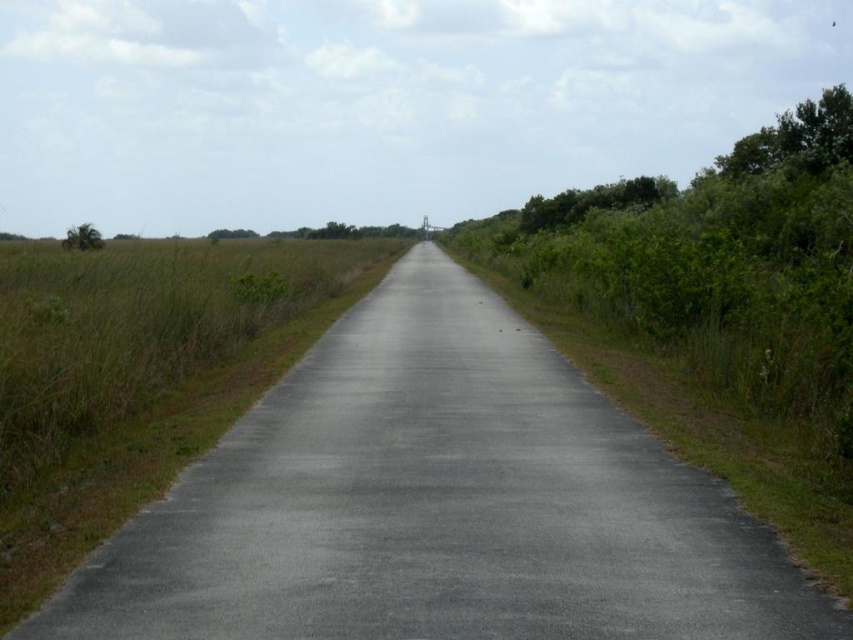
Who is taller, gray asphalt road at center or green leafy tree at right?

With more height is green leafy tree at right.

Between gray asphalt road at center and green leafy tree at right, which one appears on the left side from the viewer's perspective?

gray asphalt road at center is more to the left.

Between point (450, 609) and point (635, 200), which one is positioned behind?

The point (635, 200) is behind.

Locate an element on the screen. gray asphalt road at center is located at coordinates (438, 504).

Which of these two, green leafy tree at upper right or green leafy tree at left, stands taller?

green leafy tree at upper right is taller.

Where is `green leafy tree at upper right`? The width and height of the screenshot is (853, 640). green leafy tree at upper right is located at coordinates (x=796, y=140).

The width and height of the screenshot is (853, 640). Find the location of `green leafy tree at upper right`. green leafy tree at upper right is located at coordinates (796, 140).

Is gray asphalt road at center shorter than green grass at center?

Correct, gray asphalt road at center is not as tall as green grass at center.

Is the position of gray asphalt road at center more distant than that of green grass at center?

No, gray asphalt road at center is in front of green grass at center.

Find the location of `gray asphalt road at center`. gray asphalt road at center is located at coordinates (438, 504).